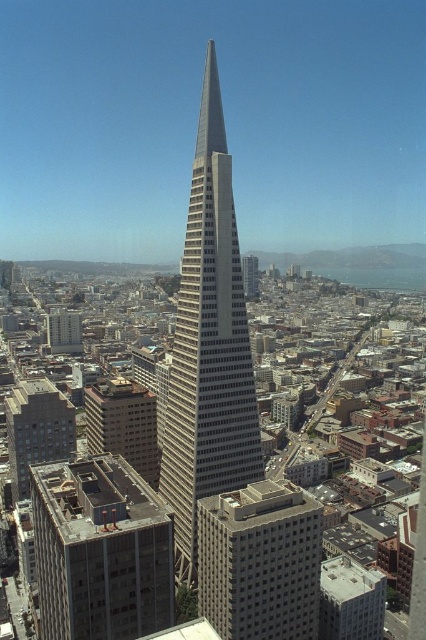
Who is shorter, gray concrete skyscraper at center or gray concrete building at lower left?

gray concrete building at lower left

Between gray concrete skyscraper at center and gray concrete building at lower left, which one appears on the right side from the viewer's perspective?

From the viewer's perspective, gray concrete skyscraper at center appears more on the right side.

Consider the image. Who is more forward, (187, 260) or (28, 412)?

Point (187, 260) is in front.

The width and height of the screenshot is (426, 640). In order to click on gray concrete skyscraper at center in this screenshot , I will do `click(209, 346)`.

Can you confirm if gray concrete skyscraper at center is bigger than white concrete building at center?

Indeed, gray concrete skyscraper at center has a larger size compared to white concrete building at center.

Is gray concrete skyscraper at center closer to the viewer compared to white concrete building at center?

No, gray concrete skyscraper at center is behind white concrete building at center.

This screenshot has height=640, width=426. What do you see at coordinates (209, 346) in the screenshot?
I see `gray concrete skyscraper at center` at bounding box center [209, 346].

At what (x,y) coordinates should I click in order to perform the action: click on gray concrete skyscraper at center. Please return your answer as a coordinate pair (x, y). Looking at the image, I should click on (209, 346).

Locate an element on the screen. The height and width of the screenshot is (640, 426). gray concrete skyscraper at center is located at coordinates (209, 346).

At what (x,y) coordinates should I click in order to perform the action: click on gray concrete skyscraper at center. Please return your answer as a coordinate pair (x, y). This screenshot has height=640, width=426. Looking at the image, I should click on (209, 346).